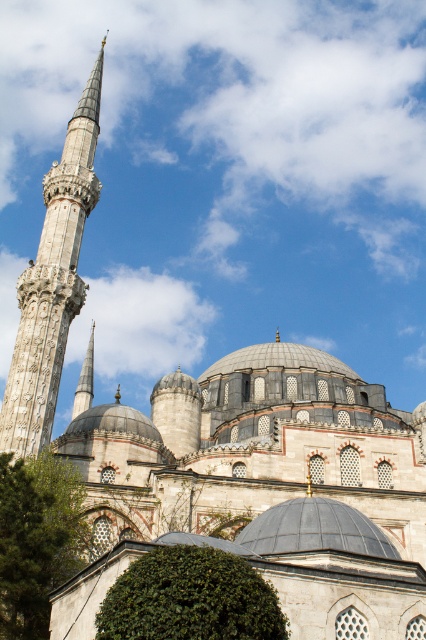
You are standing in front of the gray stone minaret at left and want to take a photo of the main dome of the mosque. The camera you are using has a maximum zoom range that allows capturing details up to 60 meters away. Can the camera capture the main dome clearly from your current position?

The gray stone minaret at left and camera are 63.10 meters apart from each other. Since the camera can only capture details up to 60 meters, it cannot capture the main dome clearly from the current position.

You are a drone operator planning to fly a drone between the gray stone minaret at left and the polished silver spire at left. The drone has a wingspan of 1.5 meters. Can the drone safely pass through the space between them?

The gray stone minaret at left and the polished silver spire at left are 182.77 feet apart, which converts to approximately 55.7 meters. Since the drone has a wingspan of only 1.5 meters, there is more than enough space for it to safely pass through the gap between them.